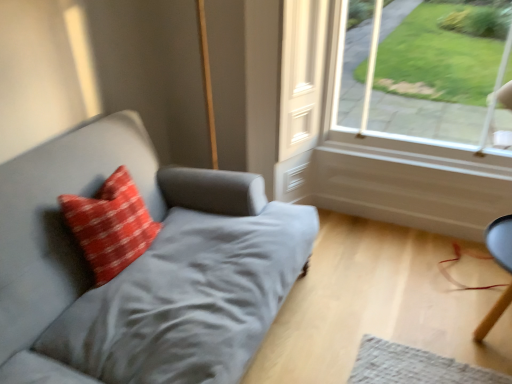
Question: From the image's perspective, relative to red textured pillow at left, is smooth black chair at lower right above or below?

Choices:
 (A) above
 (B) below

Answer: (B)

Question: Considering their positions, is smooth black chair at lower right located in front of or behind red textured pillow at left?

Choices:
 (A) front
 (B) behind

Answer: (B)

Question: Which object is the closest to the red textured pillow at left?

Choices:
 (A) smooth black chair at lower right
 (B) clear glass window at upper right
 (C) suede gray couch at left

Answer: (C)

Question: Estimate the real-world distances between objects in this image. Which object is farther from the smooth black chair at lower right?

Choices:
 (A) red textured pillow at left
 (B) clear glass window at upper right
 (C) suede gray couch at left

Answer: (A)